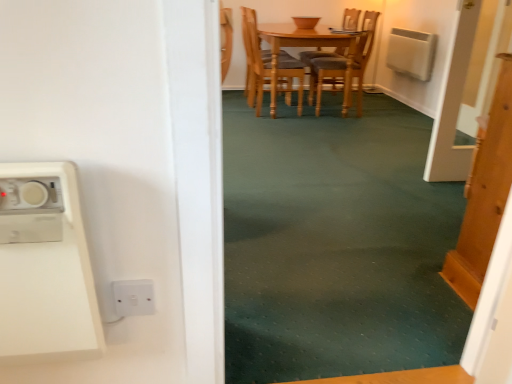
Question: Is point (289, 87) closer or farther from the camera than point (478, 236)?

Choices:
 (A) farther
 (B) closer

Answer: (A)

Question: Based on their positions, is light brown wooden chair at center located to the left or right of wooden door at right?

Choices:
 (A) right
 (B) left

Answer: (B)

Question: Which is nearer to the white plastic microwave at left?

Choices:
 (A) white plastic switch at lower center
 (B) wooden door at right
 (C) light brown wooden chair at center
 (D) light brown wooden table at center
 (E) green carpet at center

Answer: (A)

Question: Estimate the real-world distances between objects in this image. Which object is farther from the white plastic switch at lower center?

Choices:
 (A) green carpet at center
 (B) light brown wooden chair at center
 (C) white plastic microwave at left
 (D) light brown wooden table at center
 (E) wooden door at right

Answer: (D)